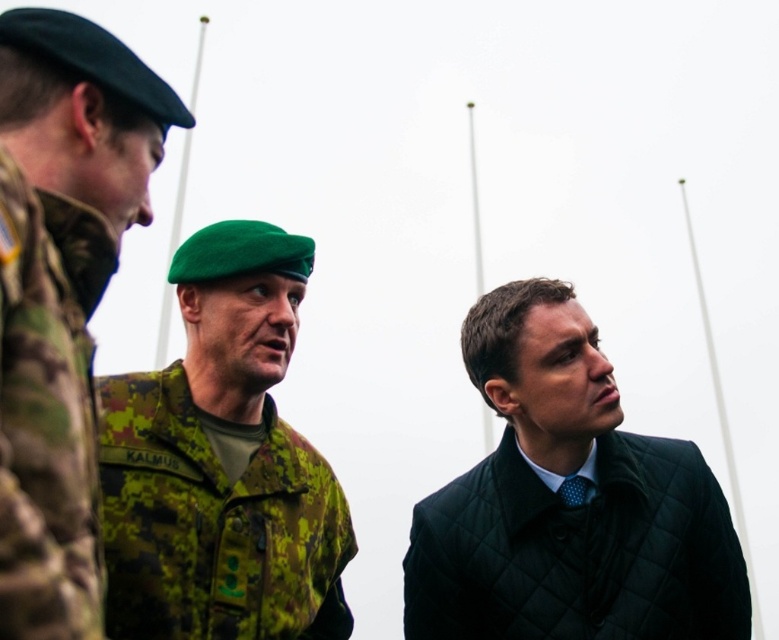
You are a photographer positioned at the back of the scene. You need to capture a photo that includes both the quilted dark green coat at center and the camo fabric uniform at left. Which object should you adjust your camera to focus on first to ensure both are in frame?

The quilted dark green coat at center is to the right of the camo fabric uniform at left, so you should focus on the camo fabric uniform at left first to ensure both are in frame.

You are a photographer trying to capture a group photo of the camouflage uniform at left and the camo fabric uniform at left. Which one should you focus on first if you want to start from the leftmost subject?

The camouflage uniform at left is more on the left side of the camo fabric uniform at left, so you should focus on the camouflage uniform at left first.